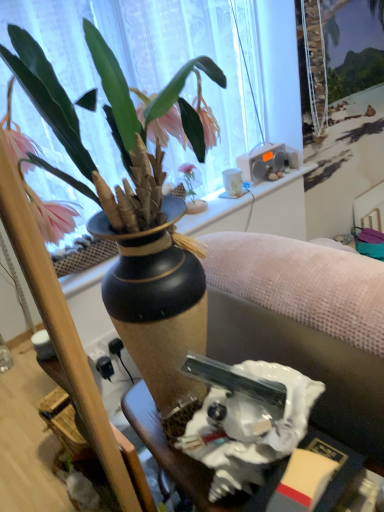
Question: In terms of width, does matte black vase at upper center look wider or thinner when compared to white glossy statue at lower center?

Choices:
 (A) wide
 (B) thin

Answer: (B)

Question: From a real-world perspective, relative to white glossy statue at lower center, is matte black vase at upper center vertically above or below?

Choices:
 (A) below
 (B) above

Answer: (B)

Question: Which object is positioned farthest from the matte gray couch at center?

Choices:
 (A) white plastic speaker at upper right
 (B) matte black vase at upper center
 (C) pink matte vase at upper center
 (D) white glossy statue at lower center

Answer: (A)

Question: Considering the real-world distances, which object is closest to the matte black vase at upper center?

Choices:
 (A) white plastic speaker at upper right
 (B) pink matte vase at upper center
 (C) matte gray couch at center
 (D) white glossy statue at lower center

Answer: (C)